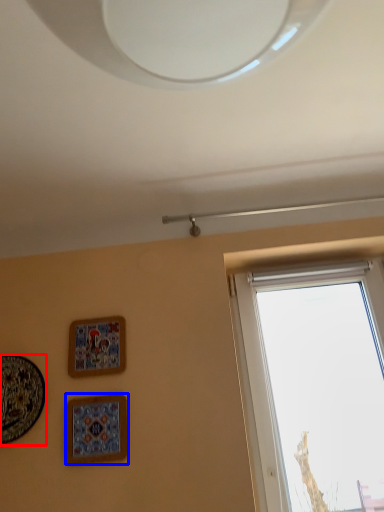
Question: Which object is further to the camera taking this photo, picture frame (highlighted by a red box) or picture frame (highlighted by a blue box)?

Choices:
 (A) picture frame
 (B) picture frame

Answer: (A)